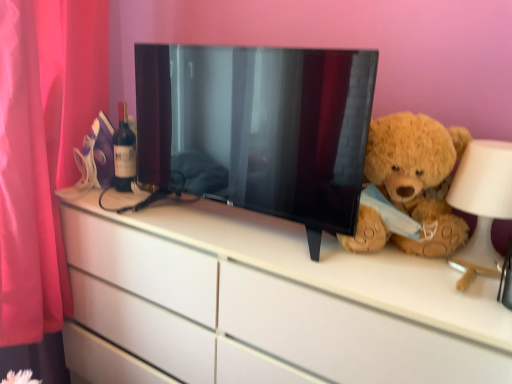
The width and height of the screenshot is (512, 384). Identify the location of vacant space underneath black glossy tv at center (from a real-world perspective). (247, 234).